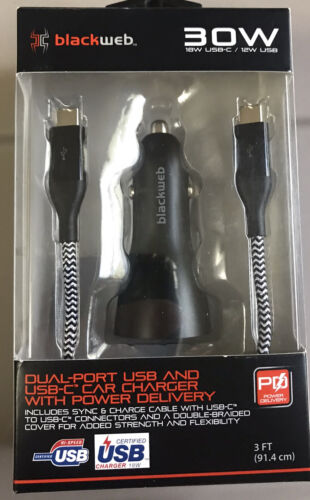
The height and width of the screenshot is (500, 310). Identify the location of cable. (67, 347), (264, 338).